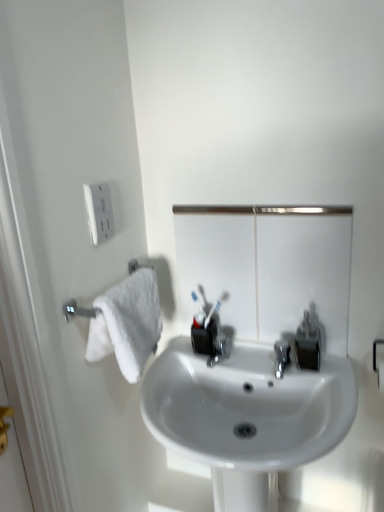
Question: From the image's perspective, is white glossy sink at center above or below matte black soap dispenser at center right?

Choices:
 (A) above
 (B) below

Answer: (B)

Question: Considering the positions of white glossy sink at center and matte black soap dispenser at center right in the image, is white glossy sink at center taller or shorter than matte black soap dispenser at center right?

Choices:
 (A) short
 (B) tall

Answer: (B)

Question: Based on their relative distances, which object is farther from the white glossy sink at center?

Choices:
 (A) matte black soap dispenser at center right
 (B) metallic reflective mirror at center
 (C) white plastic outlet at upper left

Answer: (C)

Question: Based on their relative distances, which object is nearer to the white glossy sink at center?

Choices:
 (A) metallic reflective mirror at center
 (B) white plastic outlet at upper left
 (C) matte black soap dispenser at center right

Answer: (C)